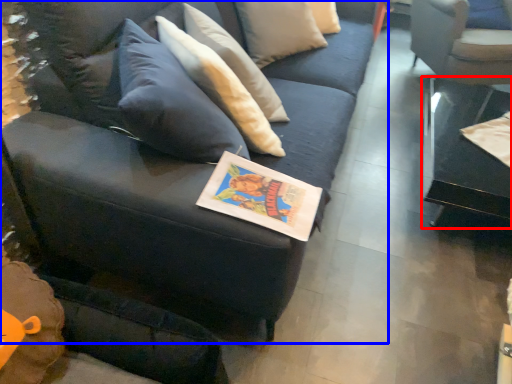
Question: Among these objects, which one is nearest to the camera, table (highlighted by a red box) or studio couch (highlighted by a blue box)?

Choices:
 (A) table
 (B) studio couch

Answer: (B)